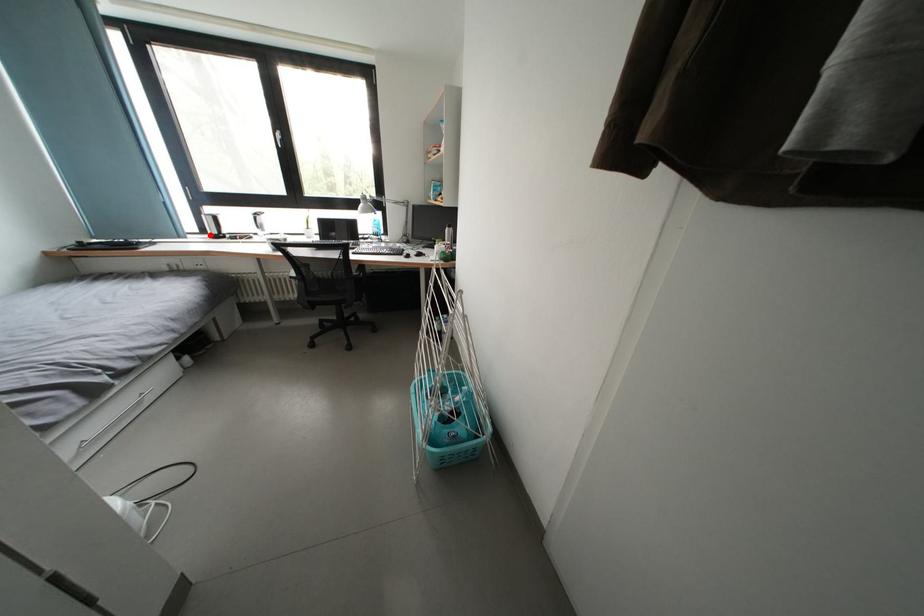
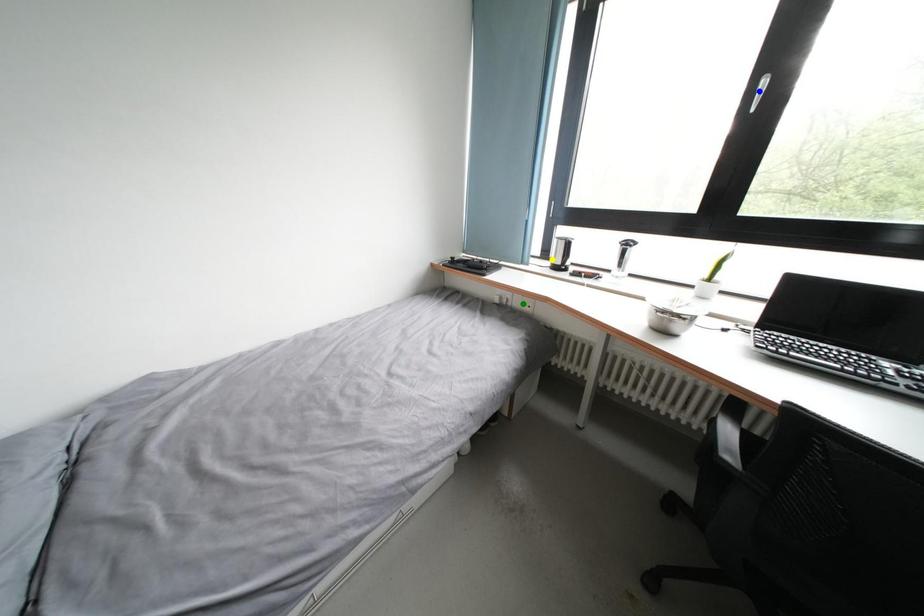
Question: I am providing you with two images of the same scene from different viewpoints. A red point is marked on the first image. You are given multiple points on the second image. In image 2, which mark is for the same physical point as the one in image 1?

Choices:
 (A) blue point
 (B) yellow point
 (C) green point

Answer: (B)